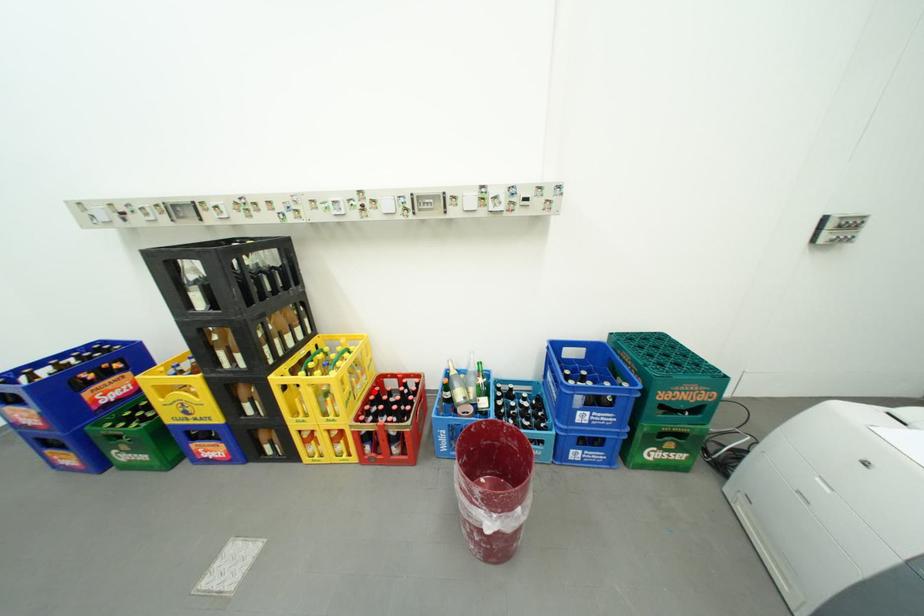
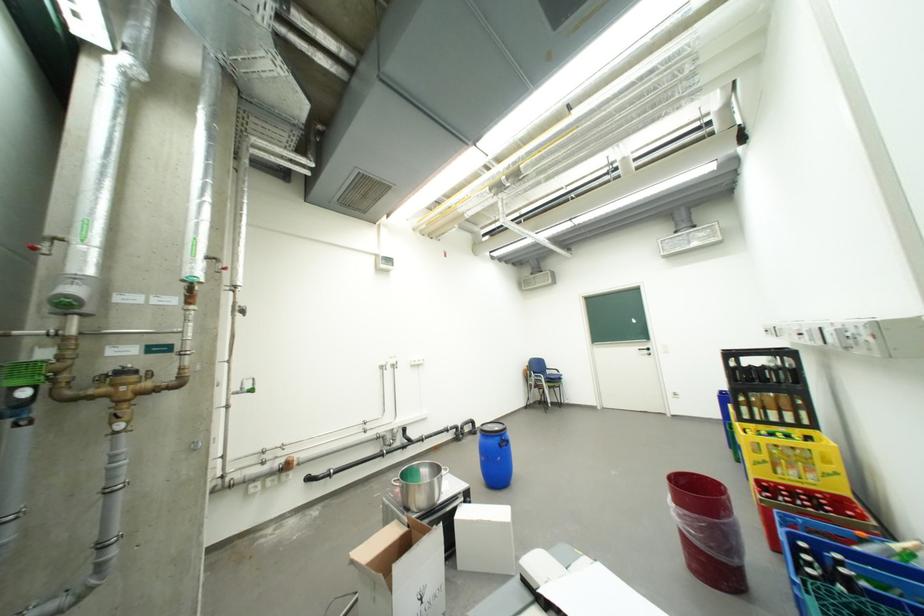
Locate, in the second image, the point that corresponds to the highlighted location in the first image.

(810, 484)